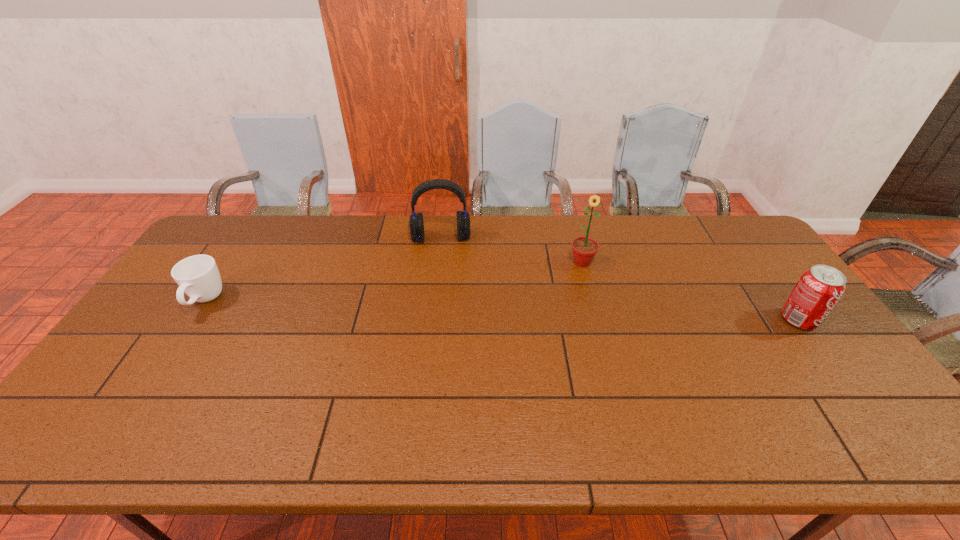
The width and height of the screenshot is (960, 540). Find the location of `blank space located 0.400m on the headband of the farthest object`. blank space located 0.400m on the headband of the farthest object is located at coordinates (445, 336).

The width and height of the screenshot is (960, 540). I want to click on vacant area situated on the headband of the farthest object, so click(x=444, y=285).

At what (x,y) coordinates should I click in order to perform the action: click on vacant space located on the headband of the farthest object. Please return your answer as a coordinate pair (x, y). This screenshot has height=540, width=960. Looking at the image, I should click on (445, 334).

Identify the location of free space located 0.070m on the face of the third object from left to right. (581, 285).

I want to click on vacant region located on the face of the third object from left to right, so click(577, 330).

This screenshot has height=540, width=960. In order to click on free space located 0.140m on the face of the third object from left to right in this screenshot , I will do point(579,301).

Locate an element on the screen. This screenshot has height=540, width=960. headset present at the far edge is located at coordinates (416, 224).

In order to click on sunflower located at the far edge in this screenshot , I will do `click(584, 249)`.

Locate an element on the screen. The width and height of the screenshot is (960, 540). object present at the left edge is located at coordinates (198, 276).

Identify the location of object at the right edge. This screenshot has width=960, height=540. (818, 290).